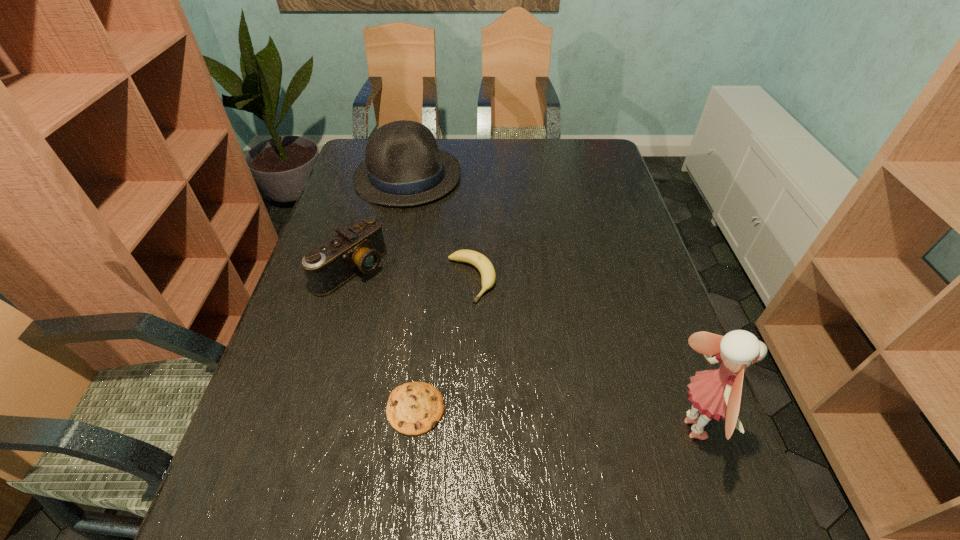
At what (x,y) coordinates should I click in order to perform the action: click on bowler hat located in the left edge section of the desktop. Please return your answer as a coordinate pair (x, y). Image resolution: width=960 pixels, height=540 pixels. Looking at the image, I should click on (403, 167).

The width and height of the screenshot is (960, 540). I want to click on object that is positioned at the right edge, so click(x=716, y=393).

The width and height of the screenshot is (960, 540). What are the coordinates of `object situated at the far left corner` in the screenshot? It's located at (403, 167).

The height and width of the screenshot is (540, 960). I want to click on object that is at the near right corner, so click(x=716, y=393).

In order to click on vacant space at the far edge of the desktop in this screenshot , I will do `click(492, 161)`.

Where is `vacant space at the near edge of the desktop`? This screenshot has height=540, width=960. vacant space at the near edge of the desktop is located at coordinates (321, 464).

In the image, there is a desktop. Where is `free space at the left edge`? Image resolution: width=960 pixels, height=540 pixels. free space at the left edge is located at coordinates (314, 370).

This screenshot has width=960, height=540. I want to click on free space at the right edge, so click(x=656, y=358).

The image size is (960, 540). Find the location of `free space at the near left corner of the desktop`. free space at the near left corner of the desktop is located at coordinates [260, 447].

Image resolution: width=960 pixels, height=540 pixels. Find the location of `vacant space at the far right corner of the desktop`. vacant space at the far right corner of the desktop is located at coordinates (579, 155).